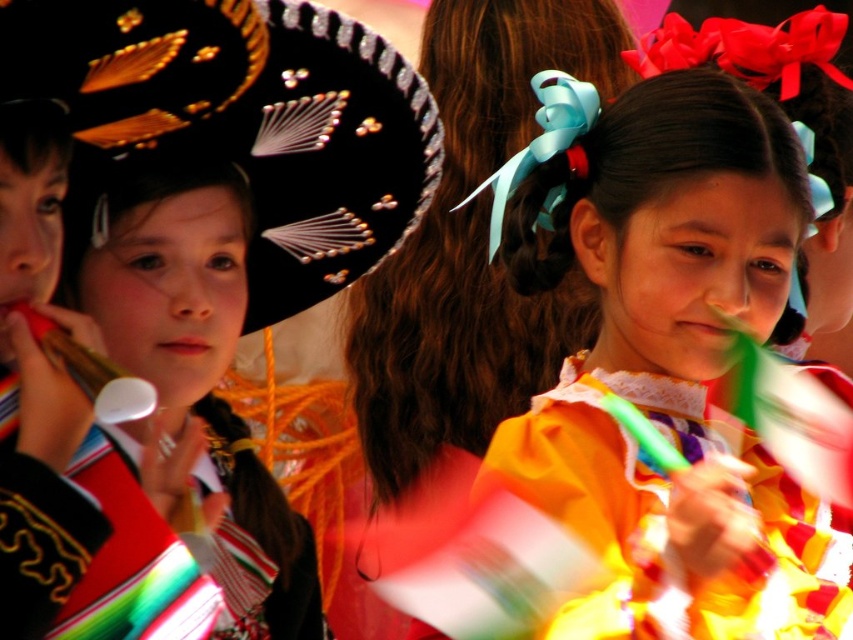
You are a photographer at the event and need to decide which dress to focus on for a closeup shot. Since the matte yellow dress at center and the yellow satin dress at center are both in the center, which one is bigger and would fill the frame better?

The matte yellow dress at center has a larger size compared to the yellow satin dress at center, so it would fill the frame better for a closeup shot.

You are a photographer trying to capture the best shot of the matte yellow dress at center and the multicolored fabric at left. Based on their positions, which object should you focus on first to ensure both are in frame?

The matte yellow dress at center is located above the multicolored fabric at left, so you should focus on the matte yellow dress at center first to ensure both are in frame.

You are a photographer trying to capture the vibrant scene of the two girls in traditional attire. You notice a specific point at coordinates (671,365). Which object in the scene is this point located on?

The point at (671,365) is on the matte yellow dress at center.